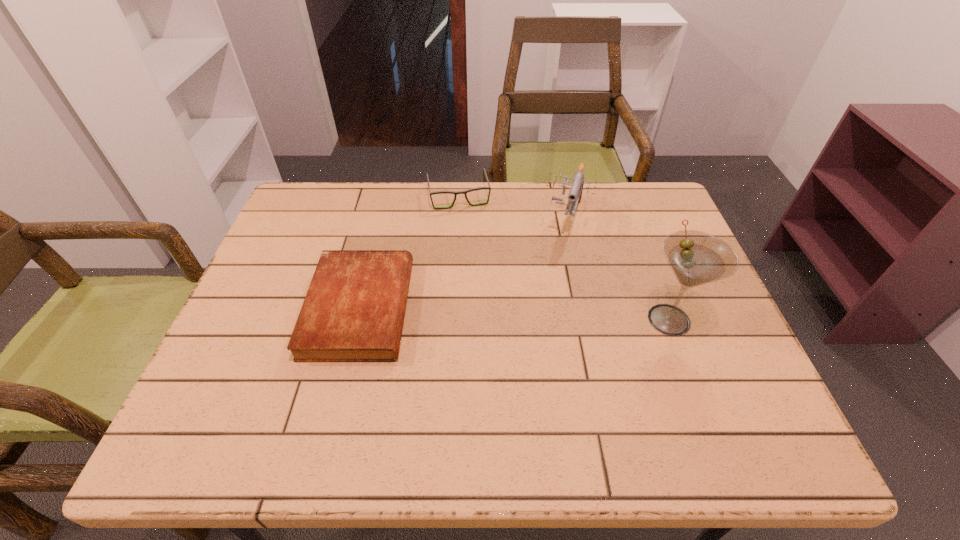
I want to click on vacant spot on the desktop that is between the shortest object and the rightmost object and is positioned at the barrel end of the second tallest object, so click(539, 315).

Locate an element on the screen. This screenshot has height=540, width=960. free space on the desktop that is between the Bible and the rightmost object and is positioned on the lens of the third tallest object is located at coordinates (485, 313).